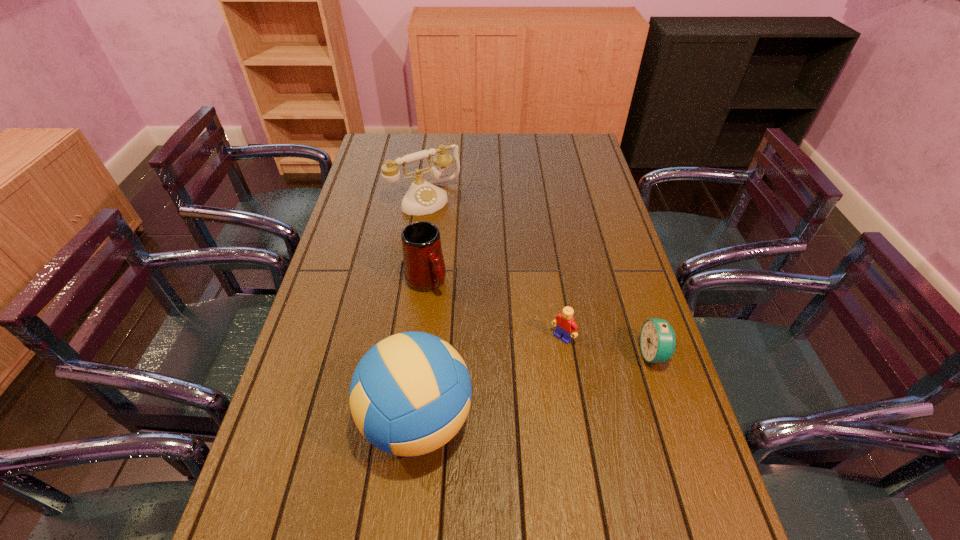
Find the location of a particular element. vacant spot on the desktop that is between the tallest object and the alarm clock and is positioned on the side of the mug with the handle is located at coordinates (518, 392).

Locate an element on the screen. The width and height of the screenshot is (960, 540). vacant spot on the desktop that is between the volleyball and the rightmost object and is positioned on the face of the fourth object from left to right is located at coordinates (507, 395).

I want to click on vacant space on the desktop that is between the tallest object and the rightmost object and is positioned on the dial of the farthest object, so click(570, 377).